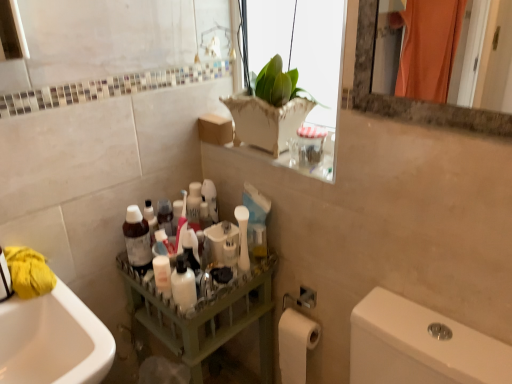
Question: Considering the positions of point (139, 238) and point (243, 233), is point (139, 238) closer or farther from the camera than point (243, 233)?

Choices:
 (A) farther
 (B) closer

Answer: (A)

Question: From the image's perspective, is matte plastic bottle at center above or below white matte toothbrush at center?

Choices:
 (A) below
 (B) above

Answer: (B)

Question: Estimate the real-world distances between objects in this image. Which object is closer to the white matte toilet paper at lower right?

Choices:
 (A) matte plastic bottle at center
 (B) white glossy bottle at center
 (C) matte green tray at center
 (D) white matte toothbrush at center
 (E) yellow fabric at left

Answer: (C)

Question: Estimate the real-world distances between objects in this image. Which object is closer to the white matte toilet paper at lower right?

Choices:
 (A) white glossy bottle at center
 (B) white ceramic vase at upper center
 (C) matte green tray at center
 (D) yellow fabric at left
 (E) white matte toothbrush at center

Answer: (C)